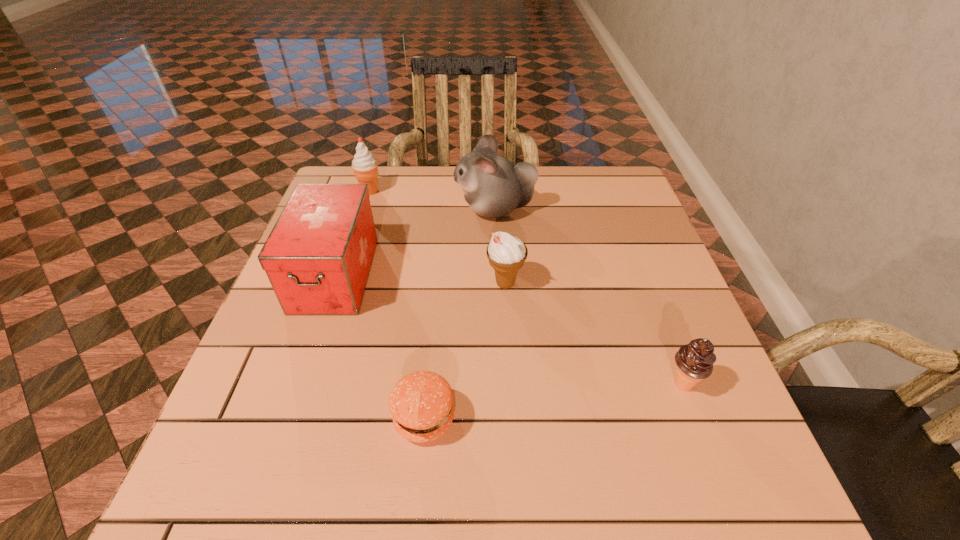
Identify the location of hamster. (493, 186).

This screenshot has height=540, width=960. Identify the location of the leftmost icecream. (364, 165).

Locate an element on the screen. The image size is (960, 540). the first-aid kit is located at coordinates (318, 256).

You are a GUI agent. You are given a task and a screenshot of the screen. Output one action in this format:
    pyautogui.click(x=<x>, y=<y>)
    Task: Click on the second farthest icecream
    
    Given the screenshot: What is the action you would take?
    pyautogui.click(x=507, y=254)

Identify the location of the shortest icecream. (695, 360).

Identify the location of the rightmost icecream. This screenshot has width=960, height=540. (695, 360).

At what (x,y) coordinates should I click in order to perform the action: click on patty. Please return your answer as a coordinate pair (x, y). Image resolution: width=960 pixels, height=540 pixels. Looking at the image, I should click on (421, 404).

You are a GUI agent. You are given a task and a screenshot of the screen. Output one action in this format:
    pyautogui.click(x=<x>, y=<y>)
    Task: Click on the free space located 0.210m on the face of the hamster
    This screenshot has width=960, height=540.
    Given the screenshot: What is the action you would take?
    pyautogui.click(x=379, y=209)

Image resolution: width=960 pixels, height=540 pixels. Identify the location of vacant area situated on the face of the hamster. (368, 209).

Where is `free spot located on the face of the hamster`? This screenshot has height=540, width=960. free spot located on the face of the hamster is located at coordinates (416, 209).